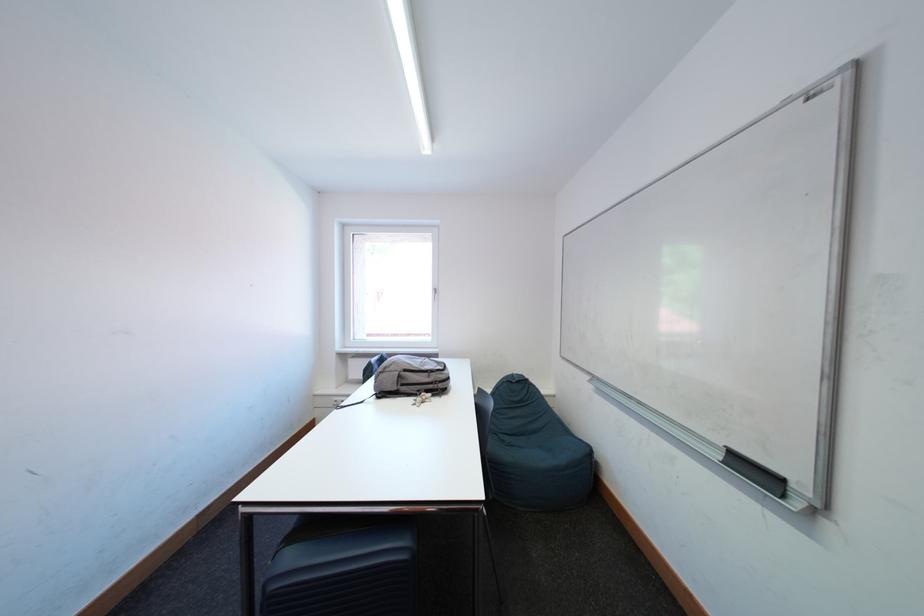
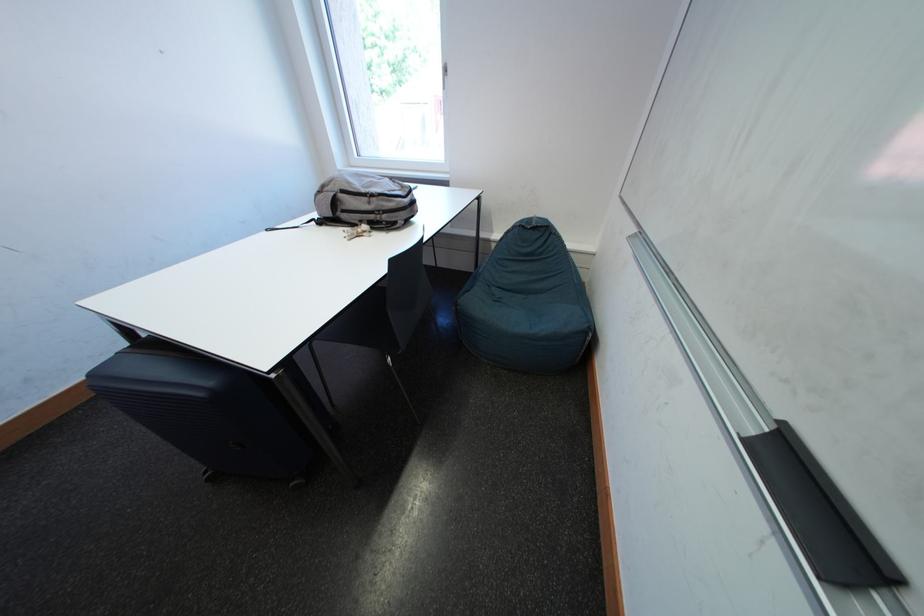
First-person continuous shooting, in which direction is the camera rotating?

The rotation direction of the camera is left-down.